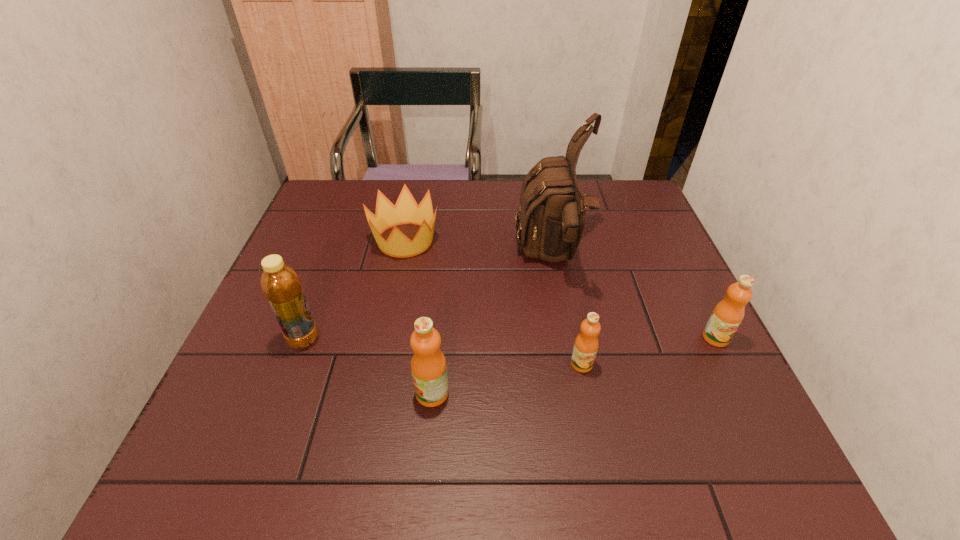
Identify the location of object that is at the near edge. (428, 364).

Locate an element on the screen. This screenshot has width=960, height=540. object that is positioned at the left edge is located at coordinates (280, 283).

Where is `object present at the right edge`? object present at the right edge is located at coordinates (728, 314).

Locate an element on the screen. vacant space at the far edge of the desktop is located at coordinates (484, 183).

In the image, there is a desktop. Identify the location of vacant space at the near edge. The width and height of the screenshot is (960, 540). (324, 387).

In the image, there is a desktop. Identify the location of vacant space at the left edge. (299, 354).

Identify the location of free space at the right edge of the desktop. This screenshot has width=960, height=540. (687, 303).

Locate an element on the screen. This screenshot has width=960, height=540. free region at the near right corner of the desktop is located at coordinates (708, 392).

The image size is (960, 540). What are the coordinates of `vacant area that lies between the second nearest orange juice and the rightmost orange juice` in the screenshot? It's located at (649, 351).

Find the location of a particular element. Image resolution: width=960 pixels, height=540 pixels. unoccupied area between the shoulder bag and the nearest orange juice is located at coordinates (492, 326).